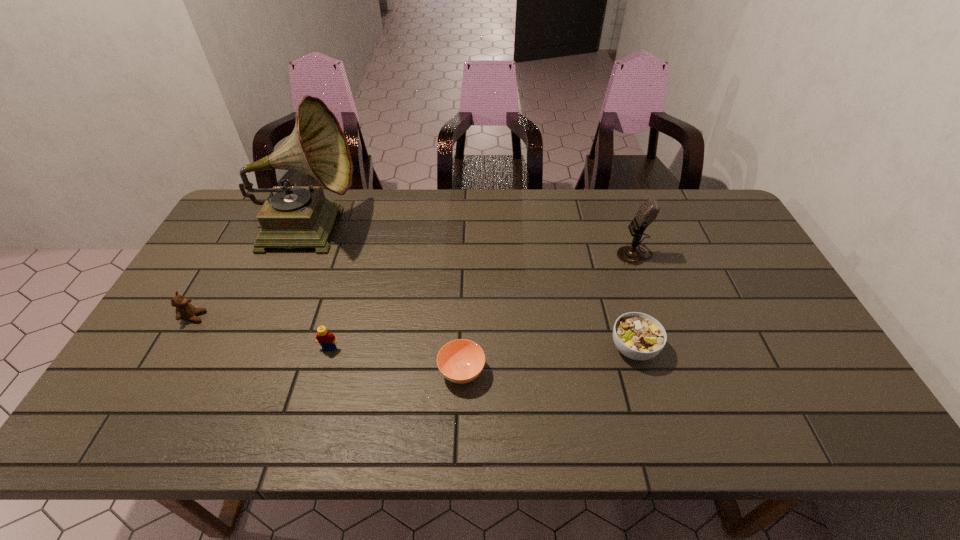
This screenshot has height=540, width=960. I want to click on record player, so click(291, 217).

Where is `microphone`? This screenshot has height=540, width=960. microphone is located at coordinates (648, 211).

Identify the location of the leftmost object. The width and height of the screenshot is (960, 540). (184, 310).

Identify the location of teddy bear. (184, 310).

The height and width of the screenshot is (540, 960). Find the location of `Lego`. Lego is located at coordinates pyautogui.click(x=326, y=339).

The image size is (960, 540). Identify the location of the taller soup bowl. point(638,336).

Identify the location of the right soup bowl. (638, 336).

You are a GUI agent. You are given a task and a screenshot of the screen. Output one action in this format:
    pyautogui.click(x=<x>, y=<y>)
    Task: Click on the shortest object
    This screenshot has width=960, height=540.
    Given the screenshot: What is the action you would take?
    pyautogui.click(x=460, y=361)

This screenshot has width=960, height=540. I want to click on the third object from right to left, so click(x=460, y=361).

You are a GUI agent. You are given a task and a screenshot of the screen. Output one action in this format:
    pyautogui.click(x=<x>, y=<y>)
    Task: Click on the vacant area situated 0.400m from the horn of the tallest object
    Image resolution: width=960 pixels, height=540 pixels.
    Given the screenshot: What is the action you would take?
    pyautogui.click(x=483, y=227)